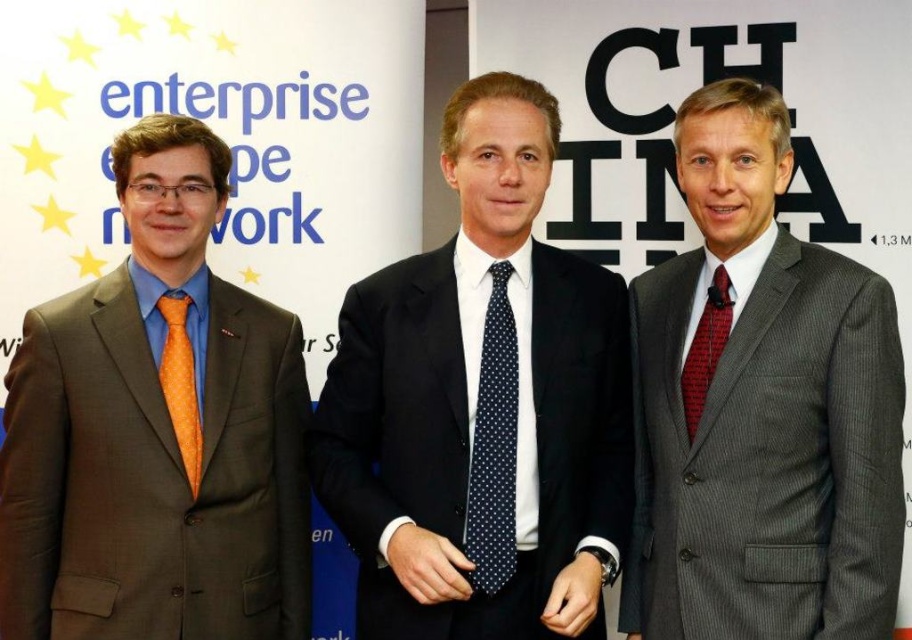
Question: Does navy blue dotted tie at center appear over orange dotted tie at left?

Choices:
 (A) yes
 (B) no

Answer: (B)

Question: From the image, what is the correct spatial relationship of orange silk tie at left in relation to orange dotted tie at left?

Choices:
 (A) left
 (B) right

Answer: (A)

Question: Which point is farther from the camera taking this photo?

Choices:
 (A) (820, 330)
 (B) (161, 385)
 (C) (439, 547)
 (D) (697, 369)

Answer: (B)

Question: Does orange silk tie at left appear under gray pinstripe suit at right?

Choices:
 (A) yes
 (B) no

Answer: (A)

Question: Which of the following is the farthest from the observer?

Choices:
 (A) orange dotted tie at left
 (B) dark blue polka dot tie at center
 (C) navy blue dotted tie at center
 (D) orange silk tie at left

Answer: (A)

Question: Which point appears farthest from the camera in this image?

Choices:
 (A) (401, 340)
 (B) (513, 472)
 (C) (114, 452)
 (D) (713, 275)

Answer: (A)